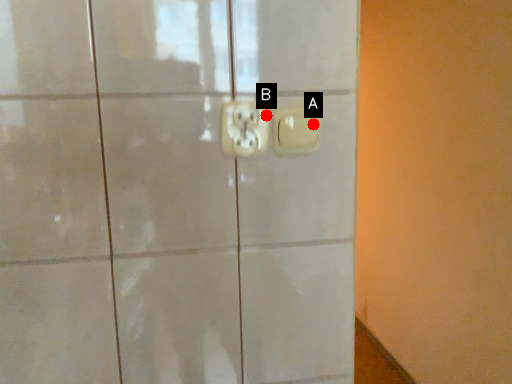
Question: Two points are circled on the image, labeled by A and B beside each circle. Among these points, which one is farthest from the camera?

Choices:
 (A) A is further
 (B) B is further

Answer: (A)